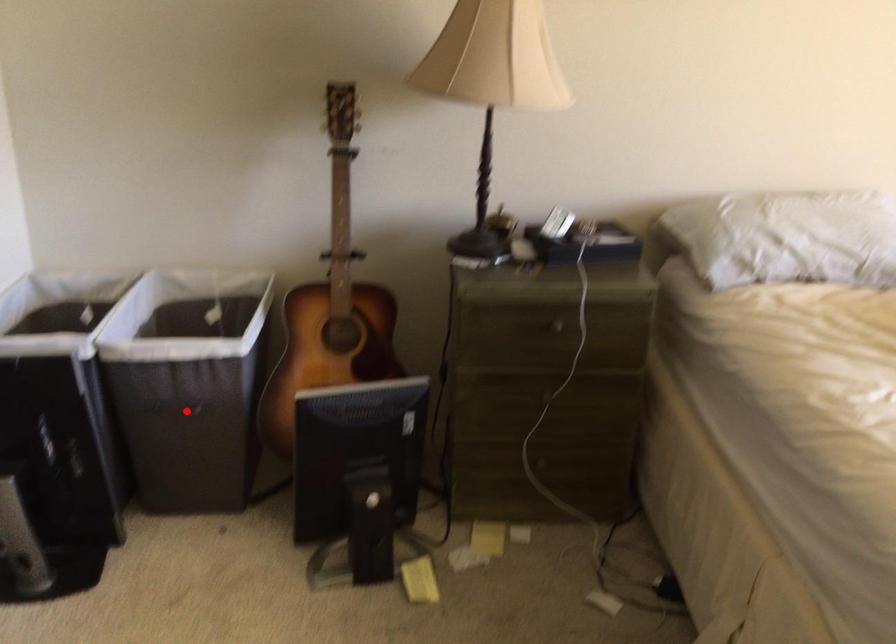
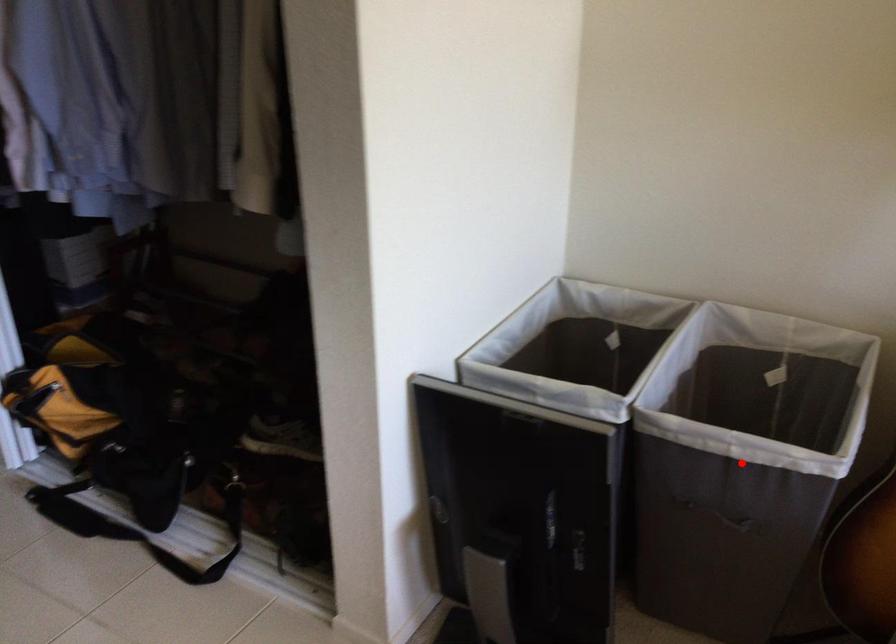
I am providing you with two images of the same scene from different viewpoints. A red point is marked on the first image and another point is marked on the second image. Do the highlighted points in image1 and image2 indicate the same real-world spot?

No